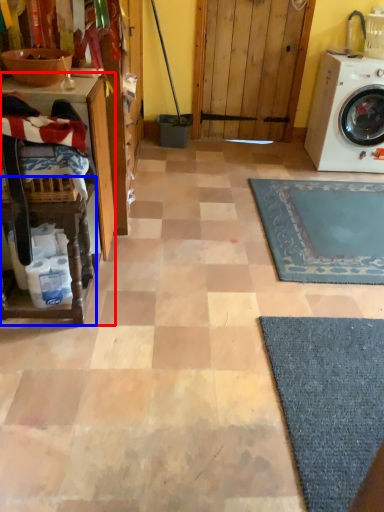
Question: Which point is closer to the camera, table (highlighted by a red box) or table (highlighted by a blue box)?

Choices:
 (A) table
 (B) table

Answer: (B)